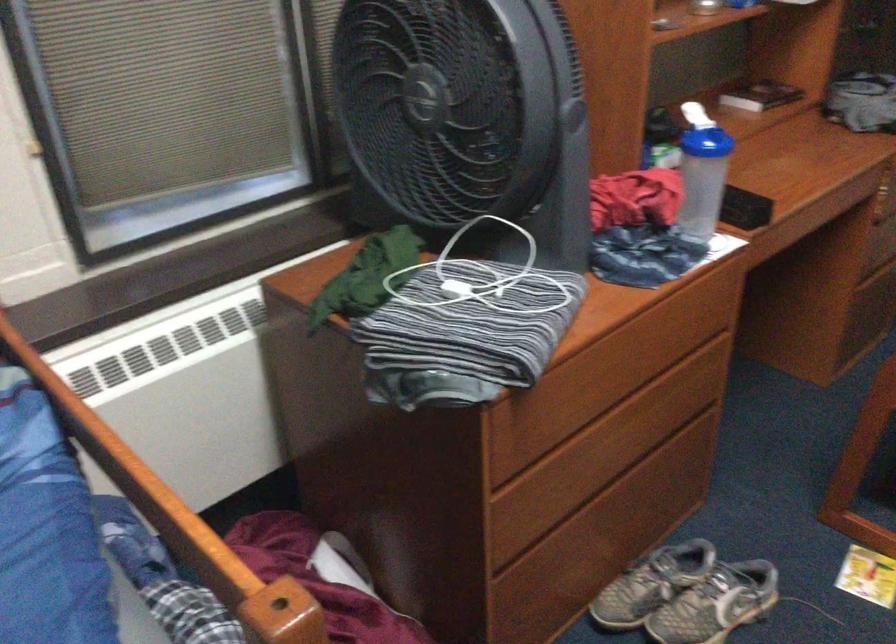
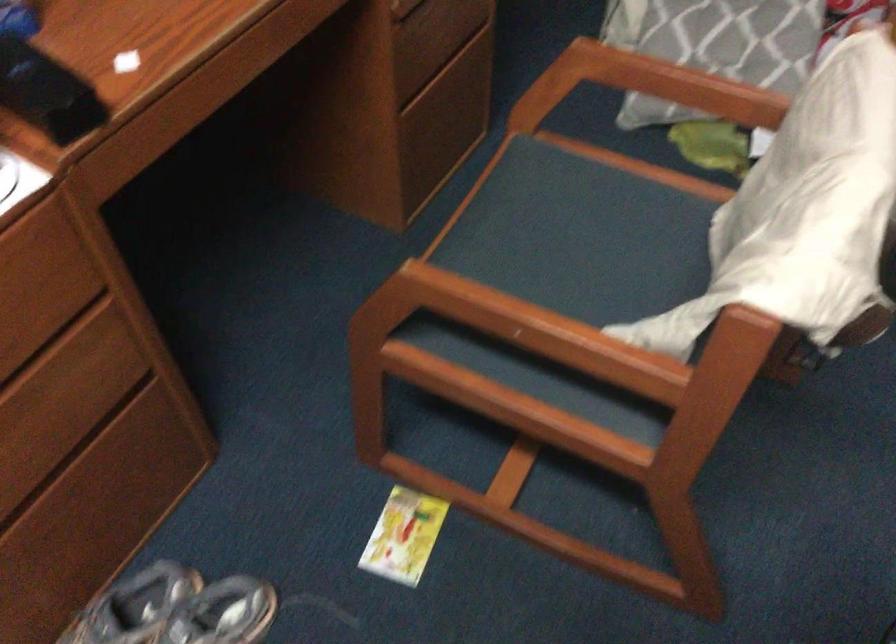
Question: How did the camera likely rotate?

Choices:
 (A) Left
 (B) Right
 (C) Up
 (D) Down

Answer: (D)